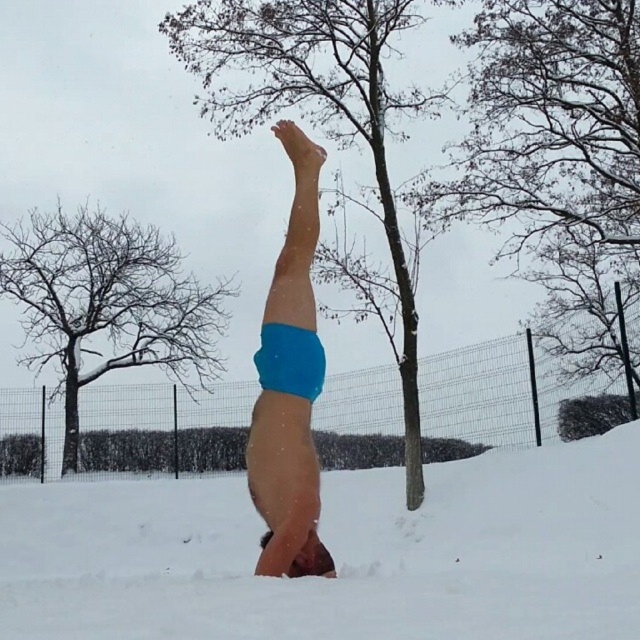
You are trying to take a photo of the blue fabric shorts at center while standing behind the white powdery snow at center. Will the snow block your view of the shorts?

The white powdery snow at center is closer to the viewer than the blue fabric shorts at center, so the snow will block your view of the shorts.

You are a photographer trying to capture the perfect shot of the person doing a headstand. You notice the white powdery snow at center and the blue fabric shorts at center. Which object in the scene is bigger?

The white powdery snow at center is larger in size compared to the blue fabric shorts at center, so the snow would appear bigger in the photo.

From the picture: You are a photographer trying to capture the perfect shot of the person doing a headstand. You notice the white powdery snow at center and the blue fabric shorts at center. Which object is lower in height compared to the other?

The white powdery snow at center is not as tall as blue fabric shorts at center, so the snow is lower in height than the shorts.